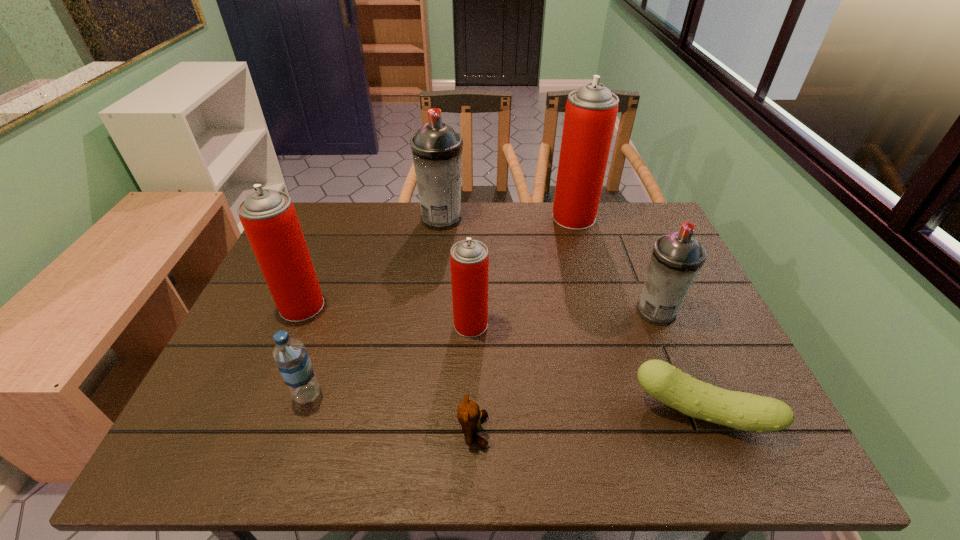
This screenshot has width=960, height=540. I want to click on free space between the tallest aerosol can and the bigger gray aerosol can, so click(x=508, y=218).

This screenshot has width=960, height=540. What are the coordinates of `free space between the second red aerosol can from left to right and the leftmost object` in the screenshot? It's located at (386, 315).

Choose which object is the fourth nearest neighbor to the left gray aerosol can. Please provide its 2D coordinates. Your answer should be formatted as a tuple, i.e. [(x, y)], where the tuple contains the x and y coordinates of a point satisfying the conditions above.

[(677, 258)]

Identify the location of object that stands as the second closest to the leftmost aerosol can. coord(436,148).

This screenshot has height=540, width=960. What are the coordinates of `the second closest aerosol can relative to the left gray aerosol can` in the screenshot? It's located at (269, 218).

Identify which aerosol can is the fifth nearest to the cucumber. Please provide its 2D coordinates. Your answer should be formatted as a tuple, i.e. [(x, y)], where the tuple contains the x and y coordinates of a point satisfying the conditions above.

[(269, 218)]

Point out which red aerosol can is positioned as the second nearest to the second biggest red aerosol can. Please provide its 2D coordinates. Your answer should be formatted as a tuple, i.e. [(x, y)], where the tuple contains the x and y coordinates of a point satisfying the conditions above.

[(591, 111)]

Identify which red aerosol can is the nearest to the smallest red aerosol can. Please provide its 2D coordinates. Your answer should be formatted as a tuple, i.e. [(x, y)], where the tuple contains the x and y coordinates of a point satisfying the conditions above.

[(269, 218)]

Where is `vacant space that satisfies the following two spatial constraints: 1. on the front side of the tallest aerosol can; 2. on the left side of the smaller gray aerosol can`? vacant space that satisfies the following two spatial constraints: 1. on the front side of the tallest aerosol can; 2. on the left side of the smaller gray aerosol can is located at coordinates coord(600,312).

This screenshot has height=540, width=960. Find the location of `free space in the image that satisfies the following two spatial constraints: 1. on the back side of the leftmost object; 2. on the left side of the bigger gray aerosol can`. free space in the image that satisfies the following two spatial constraints: 1. on the back side of the leftmost object; 2. on the left side of the bigger gray aerosol can is located at coordinates (338, 219).